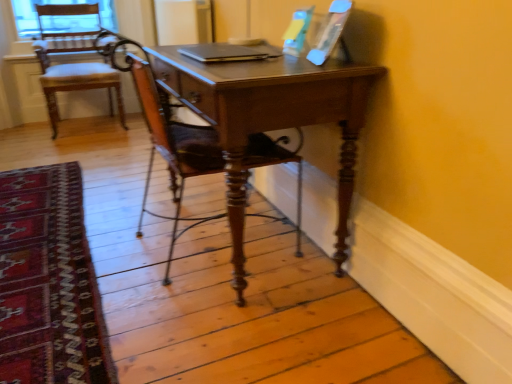
Identify the location of free space to the back side of carpet with intricate patterns at lower left. This screenshot has width=512, height=384. (101, 159).